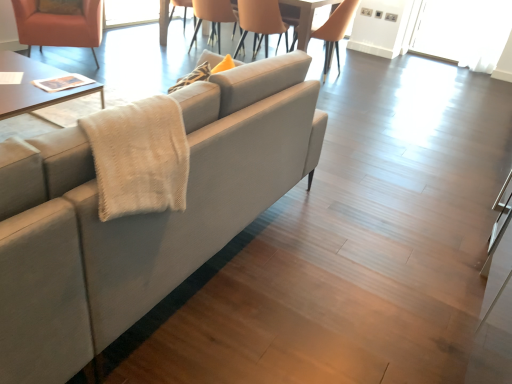
Describe the element at coordinates (463, 32) in the screenshot. The height and width of the screenshot is (384, 512). I see `transparent glass door at upper right` at that location.

Identify the location of transparent glass door at upper right. (463, 32).

Where is `wooden glossy table at upper center`? The image size is (512, 384). wooden glossy table at upper center is located at coordinates (307, 16).

What do you see at coordinates (335, 31) in the screenshot?
I see `light brown leather chair at upper center, positioned as the 1th chair in right-to-left order` at bounding box center [335, 31].

The height and width of the screenshot is (384, 512). Identify the location of matte orange armchair at upper left, the 4th chair viewed from the right. (59, 26).

Is wooden glossy table at upper center bigger than light gray fabric couch at center?

Incorrect, wooden glossy table at upper center is not larger than light gray fabric couch at center.

From a real-world perspective, who is located higher, wooden glossy table at upper center or light gray fabric couch at center?

light gray fabric couch at center, from a real-world perspective.

Is point (315, 3) less distant than point (224, 130)?

No, (315, 3) is behind (224, 130).

Is light gray fabric couch at center taller than wooden glossy table at upper center?

Yes.

Who is smaller, light gray fabric couch at center or wooden glossy table at upper center?

wooden glossy table at upper center.

What are the coordinates of `table on the right of light gray fabric couch at center` in the screenshot? It's located at (307, 16).

Does light gray fabric couch at center have a lesser width compared to wooden glossy table at upper center?

No.

Is matte orange armchair at upper left, which is counted as the first chair, starting from the left, not within orange leather chair at upper center, which is the 2th chair in left-to-right order?

Absolutely, matte orange armchair at upper left, which is counted as the first chair, starting from the left, is external to orange leather chair at upper center, which is the 2th chair in left-to-right order.

Locate an element on the screen. The width and height of the screenshot is (512, 384). the 3rd chair in front of the orange leather chair at upper center, which is counted as the third chair, starting from the right is located at coordinates (59, 26).

Is the depth of matte orange armchair at upper left, which is counted as the first chair, starting from the left, less than that of orange leather chair at upper center, which is the 2th chair in left-to-right order?

Yes, matte orange armchair at upper left, which is counted as the first chair, starting from the left, is closer to the camera.

In the scene shown: Can you confirm if matte orange armchair at upper left, which is counted as the first chair, starting from the left, is bigger than orange leather chair at upper center, which is the 2th chair in left-to-right order?

Yes, matte orange armchair at upper left, which is counted as the first chair, starting from the left, is bigger than orange leather chair at upper center, which is the 2th chair in left-to-right order.

From the matte orange armchair at upper left, the 4th chair viewed from the right, count 3rd chair to the right and point to it. Please provide its 2D coordinates.

[(335, 31)]

Which object is thinner, light brown leather chair at upper center, positioned as the 1th chair in right-to-left order, or matte orange armchair at upper left, the 4th chair viewed from the right?

With smaller width is light brown leather chair at upper center, positioned as the 1th chair in right-to-left order.

In terms of height, does light brown leather chair at upper center, positioned as the 1th chair in right-to-left order, look taller or shorter compared to matte orange armchair at upper left, the 4th chair viewed from the right?

In the image, light brown leather chair at upper center, positioned as the 1th chair in right-to-left order, appears to be taller than matte orange armchair at upper left, the 4th chair viewed from the right.

Can you confirm if light brown leather chair at upper center, positioned as the 1th chair in right-to-left order, is positioned to the right of matte orange armchair at upper left, the 4th chair viewed from the right?

Yes.

Does wooden glossy table at upper center have a lesser height compared to transparent glass door at upper right?

Yes, wooden glossy table at upper center is shorter than transparent glass door at upper right.

Is wooden glossy table at upper center next to transparent glass door at upper right and touching it?

wooden glossy table at upper center and transparent glass door at upper right are clearly separated.

Considering the sizes of objects wooden glossy table at upper center and transparent glass door at upper right in the image provided, who is bigger, wooden glossy table at upper center or transparent glass door at upper right?

Bigger between the two is wooden glossy table at upper center.

Considering the points (333, 0) and (429, 26), which point is behind, point (333, 0) or point (429, 26)?

The point (429, 26) is behind.

Can transparent glass door at upper right be found inside matte beige chair at upper center, placed as the second chair when sorted from right to left?

Definitely not — transparent glass door at upper right is not inside matte beige chair at upper center, placed as the second chair when sorted from right to left.

Which of these two, matte beige chair at upper center, placed as the second chair when sorted from right to left, or transparent glass door at upper right, is wider?

matte beige chair at upper center, placed as the second chair when sorted from right to left, is wider.

Is matte beige chair at upper center, placed as the second chair when sorted from right to left, taller than transparent glass door at upper right?

Incorrect, the height of matte beige chair at upper center, placed as the second chair when sorted from right to left, is not larger of that of transparent glass door at upper right.

Is matte beige chair at upper center, placed as the second chair when sorted from right to left, further to the viewer compared to transparent glass door at upper right?

No, matte beige chair at upper center, placed as the second chair when sorted from right to left, is closer to the camera.

Does transparent glass door at upper right have a greater width compared to matte beige chair at upper center, placed as the second chair when sorted from right to left?

No.

From the image's perspective, does transparent glass door at upper right appear lower than matte beige chair at upper center, placed as the second chair when sorted from right to left?

No, from the image's perspective, transparent glass door at upper right is not below matte beige chair at upper center, placed as the second chair when sorted from right to left.

Which object is further away from the camera, transparent glass door at upper right or matte beige chair at upper center, placed as the second chair when sorted from right to left?

transparent glass door at upper right is further away from the camera.

Locate an element on the screen. This screenshot has height=384, width=512. glass door that appears behind the matte beige chair at upper center, which appears as the third chair when viewed from the left is located at coordinates (463, 32).

Where is `studio couch above the wooden glossy table at upper center (from a real-world perspective)`? studio couch above the wooden glossy table at upper center (from a real-world perspective) is located at coordinates (140, 216).

The height and width of the screenshot is (384, 512). I want to click on table below the light gray fabric couch at center (from a real-world perspective), so click(307, 16).

Considering their positions, is light gray fabric couch at center positioned closer to light brown leather chair at upper center, positioned as the 1th chair in right-to-left order, than wooden glossy table at upper center?

Among the two, wooden glossy table at upper center is located nearer to light brown leather chair at upper center, positioned as the 1th chair in right-to-left order.

From the image, which object appears to be nearer to wooden glossy table at upper center, orange leather chair at upper center, which is counted as the third chair, starting from the right, or light gray fabric couch at center?

Among the two, orange leather chair at upper center, which is counted as the third chair, starting from the right, is located nearer to wooden glossy table at upper center.

When comparing their distances from light gray fabric couch at center, does matte orange armchair at upper left, which is counted as the first chair, starting from the left, or light brown leather chair at upper center, which is the 4th chair from left to right, seem closer?

matte orange armchair at upper left, which is counted as the first chair, starting from the left, is closer to light gray fabric couch at center.

Based on the photo, when comparing their distances from wooden glossy table at upper center, does transparent glass door at upper right or light gray fabric couch at center seem closer?

Among the two, transparent glass door at upper right is located nearer to wooden glossy table at upper center.

Based on their spatial positions, is orange leather chair at upper center, which is the 2th chair in left-to-right order, or matte orange armchair at upper left, which is counted as the first chair, starting from the left, further from light brown leather chair at upper center, positioned as the 1th chair in right-to-left order?

The object further to light brown leather chair at upper center, positioned as the 1th chair in right-to-left order, is matte orange armchair at upper left, which is counted as the first chair, starting from the left.

Looking at the image, which one is located further to matte beige chair at upper center, placed as the second chair when sorted from right to left, orange leather chair at upper center, which is counted as the third chair, starting from the right, or matte orange armchair at upper left, the 4th chair viewed from the right?

Based on the image, matte orange armchair at upper left, the 4th chair viewed from the right, appears to be further to matte beige chair at upper center, placed as the second chair when sorted from right to left.

In the scene shown: Estimate the real-world distances between objects in this image. Which object is closer to matte orange armchair at upper left, the 4th chair viewed from the right, matte beige chair at upper center, which appears as the third chair when viewed from the left, or wooden glossy table at upper center?

Among the two, matte beige chair at upper center, which appears as the third chair when viewed from the left, is located nearer to matte orange armchair at upper left, the 4th chair viewed from the right.

When comparing their distances from light gray fabric couch at center, does orange leather chair at upper center, which is the 2th chair in left-to-right order, or matte beige chair at upper center, which appears as the third chair when viewed from the left, seem further?

Among the two, orange leather chair at upper center, which is the 2th chair in left-to-right order, is located further to light gray fabric couch at center.

Locate an element on the screen. This screenshot has height=384, width=512. studio couch between matte orange armchair at upper left, which is counted as the first chair, starting from the left, and transparent glass door at upper right is located at coordinates (140, 216).

Where is `chair between wooden glossy table at upper center and light brown leather chair at upper center, which is the 4th chair from left to right`? The width and height of the screenshot is (512, 384). chair between wooden glossy table at upper center and light brown leather chair at upper center, which is the 4th chair from left to right is located at coordinates pos(260,22).

Locate an element on the screen. Image resolution: width=512 pixels, height=384 pixels. chair situated between orange leather chair at upper center, which is the 2th chair in left-to-right order, and light brown leather chair at upper center, which is the 4th chair from left to right, from left to right is located at coordinates (260, 22).

Find the location of a particular element. This screenshot has width=512, height=384. table located between orange leather chair at upper center, which is counted as the third chair, starting from the right, and light brown leather chair at upper center, which is the 4th chair from left to right, in the left-right direction is located at coordinates (307, 16).